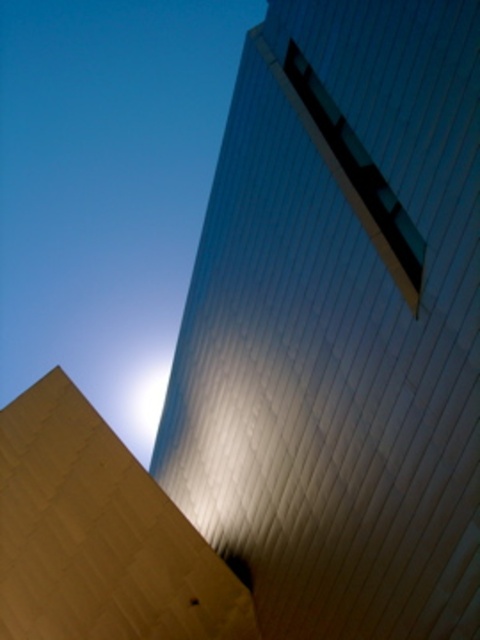
This screenshot has height=640, width=480. I want to click on matte beige pyramid at lower left, so click(x=340, y=324).

Is matte beige pyramid at lower left shorter than matte beige pyramid at center?

No, matte beige pyramid at lower left is not shorter than matte beige pyramid at center.

Locate an element on the screen. The image size is (480, 640). matte beige pyramid at lower left is located at coordinates (340, 324).